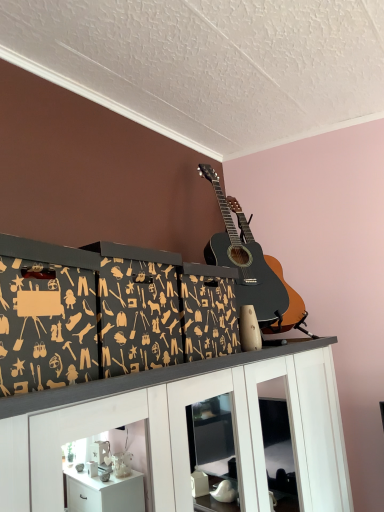
Question: Does black cardboard boxes at center lie in front of white glossy cabinet at upper center?

Choices:
 (A) yes
 (B) no

Answer: (B)

Question: Does black cardboard boxes at center have a lesser height compared to white glossy cabinet at upper center?

Choices:
 (A) no
 (B) yes

Answer: (B)

Question: Are black cardboard boxes at center and white glossy cabinet at upper center located far from each other?

Choices:
 (A) yes
 (B) no

Answer: (B)

Question: Does black cardboard boxes at center turn towards white glossy cabinet at upper center?

Choices:
 (A) yes
 (B) no

Answer: (B)

Question: From a real-world perspective, does black cardboard boxes at center sit lower than white glossy cabinet at upper center?

Choices:
 (A) yes
 (B) no

Answer: (B)

Question: Would you say white glossy cabinet at upper center is to the left or to the right of black acoustic guitar at upper center in the picture?

Choices:
 (A) left
 (B) right

Answer: (A)

Question: Looking at the image, does white glossy cabinet at upper center seem bigger or smaller compared to black acoustic guitar at upper center?

Choices:
 (A) big
 (B) small

Answer: (A)

Question: Considering the positions of point (286, 375) and point (226, 227), is point (286, 375) closer or farther from the camera than point (226, 227)?

Choices:
 (A) farther
 (B) closer

Answer: (B)

Question: Considering the positions of white glossy cabinet at upper center and black acoustic guitar at upper center in the image, is white glossy cabinet at upper center wider or thinner than black acoustic guitar at upper center?

Choices:
 (A) wide
 (B) thin

Answer: (A)

Question: From the image's perspective, is black acoustic guitar at upper center above or below white glossy cabinet at upper center?

Choices:
 (A) above
 (B) below

Answer: (A)

Question: Considering the relative positions of black acoustic guitar at upper center and white glossy cabinet at upper center in the image provided, is black acoustic guitar at upper center to the left or to the right of white glossy cabinet at upper center?

Choices:
 (A) left
 (B) right

Answer: (B)

Question: Considering the positions of black acoustic guitar at upper center and white glossy cabinet at upper center in the image, is black acoustic guitar at upper center taller or shorter than white glossy cabinet at upper center?

Choices:
 (A) tall
 (B) short

Answer: (B)

Question: In the image, is black acoustic guitar at upper center positioned in front of or behind white glossy cabinet at upper center?

Choices:
 (A) behind
 (B) front

Answer: (A)

Question: From their relative heights in the image, would you say black cardboard boxes at center is taller or shorter than white glossy cabinet at upper center?

Choices:
 (A) tall
 (B) short

Answer: (B)

Question: From the image's perspective, is black cardboard boxes at center positioned above or below white glossy cabinet at upper center?

Choices:
 (A) below
 (B) above

Answer: (B)